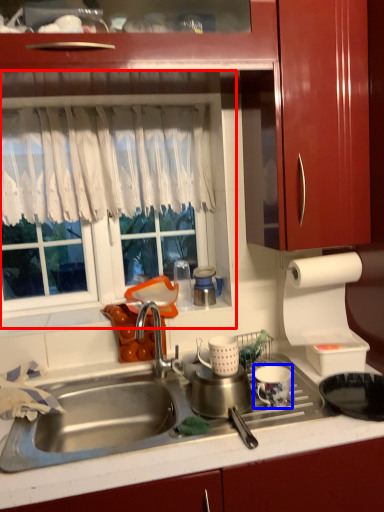
Question: Among these objects, which one is farthest to the camera, window screen (highlighted by a red box) or tableware (highlighted by a blue box)?

Choices:
 (A) window screen
 (B) tableware

Answer: (A)